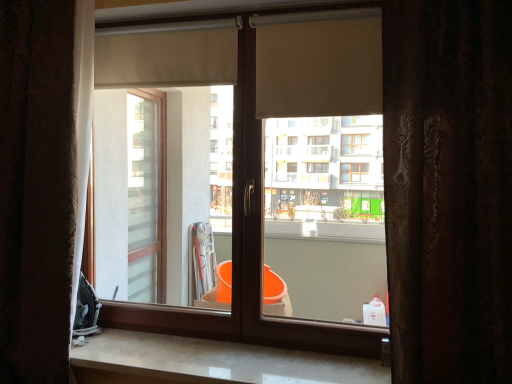
At what (x,y) coordinates should I click in order to perform the action: click on free spot above matte wood window at center (from a real-world perspective). Please return your answer as a coordinate pair (x, y). Looking at the image, I should click on (203, 8).